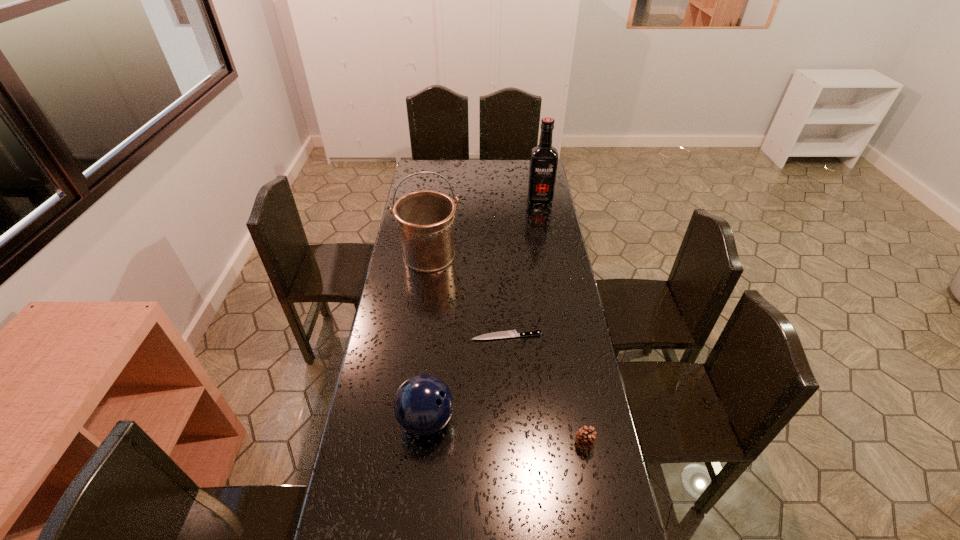
Where is `the farthest object`? the farthest object is located at coordinates point(543,163).

Locate an element on the screen. the fourth nearest object is located at coordinates (425, 219).

The height and width of the screenshot is (540, 960). Find the location of `bowling ball`. bowling ball is located at coordinates (423, 404).

You are a GUI agent. You are given a task and a screenshot of the screen. Output one action in this format:
    pyautogui.click(x=<x>, y=<y>)
    Task: Click on the pinecone
    This screenshot has width=960, height=540.
    Given the screenshot: What is the action you would take?
    pyautogui.click(x=585, y=438)

Identify the location of the third object from right to left. Image resolution: width=960 pixels, height=540 pixels. (511, 333).

Locate an element on the screen. This screenshot has height=540, width=960. steak knife is located at coordinates tap(511, 333).

At what (x,y) coordinates should I click in order to perform the action: click on vacant space positioned 0.340m on the front-facing side of the liquor. Please return your answer as a coordinate pair (x, y). The height and width of the screenshot is (540, 960). Looking at the image, I should click on (548, 248).

At what (x,y) coordinates should I click in order to perform the action: click on vacant region located on the right of the bucket. Please return your answer as a coordinate pair (x, y). Looking at the image, I should click on (492, 255).

At what (x,y) coordinates should I click in order to perform the action: click on free space located 0.130m on the surface of the third tallest object near the finger holes. Please return your answer as a coordinate pair (x, y). Image resolution: width=960 pixels, height=540 pixels. Looking at the image, I should click on (497, 420).

Find the location of a particular element. This screenshot has height=540, width=960. vacant area situated 0.070m on the front of the pinecone is located at coordinates (590, 477).